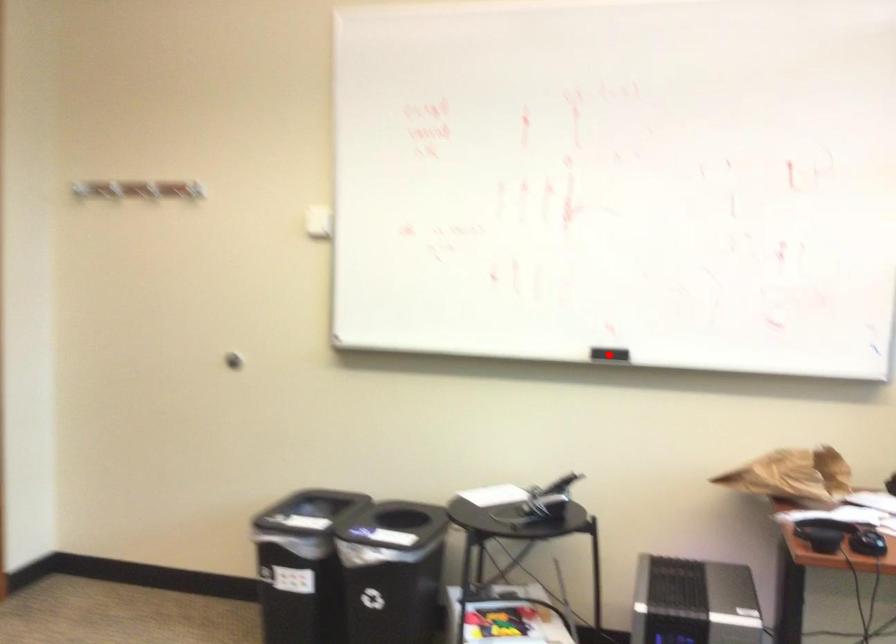
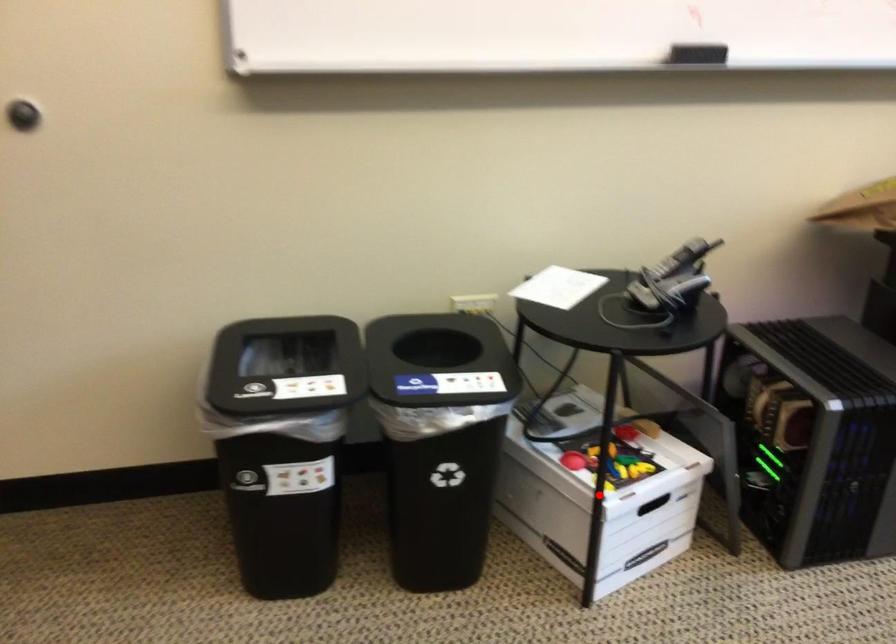
I am providing you with two images of the same scene from different viewpoints. A red point is marked on the first image and another point is marked on the second image. Are the points marked in image1 and image2 representing the same 3D position?

No